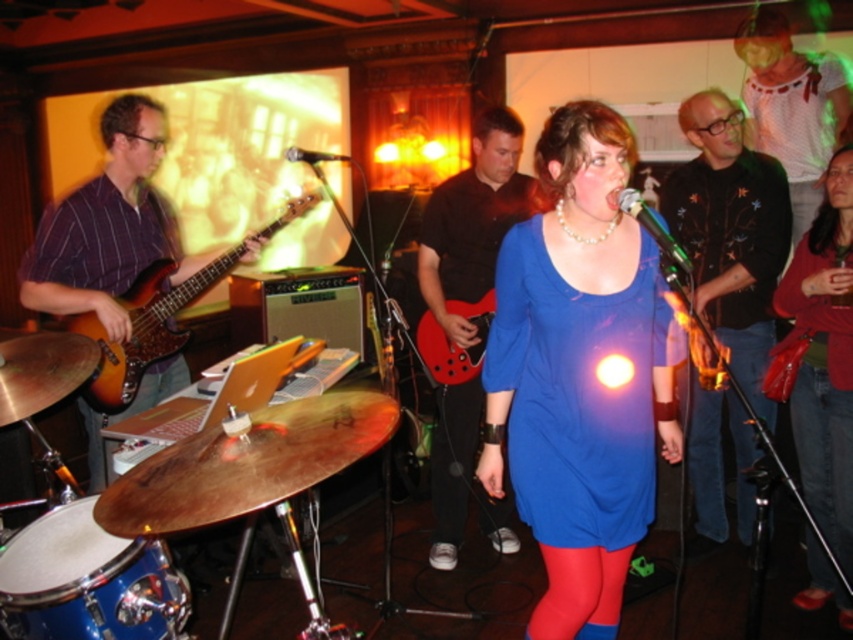
Which of these two, blue fabric dress at center or metallic silver microphone at center, stands taller?

blue fabric dress at center is taller.

Is point (556, 477) positioned before point (303, 161)?

Yes.

The width and height of the screenshot is (853, 640). What are the coordinates of `blue fabric dress at center` in the screenshot? It's located at (579, 372).

Does sunburst wood guitar at left appear over metallic silver microphone at center?

Actually, sunburst wood guitar at left is below metallic silver microphone at center.

Consider the image. Is sunburst wood guitar at left further to the viewer compared to metallic silver microphone at center?

Yes.

Is point (160, 291) farther from viewer compared to point (300, 161)?

Yes, it is.

This screenshot has height=640, width=853. In order to click on sunburst wood guitar at left in this screenshot , I will do `click(158, 317)`.

Is point (761, 272) behind point (663, 248)?

Yes, it is.

Between black leather jacket at upper right and shiny metallic microphone at center, which one has less height?

Standing shorter between the two is shiny metallic microphone at center.

Where is `black leather jacket at upper right`? The height and width of the screenshot is (640, 853). black leather jacket at upper right is located at coordinates (730, 234).